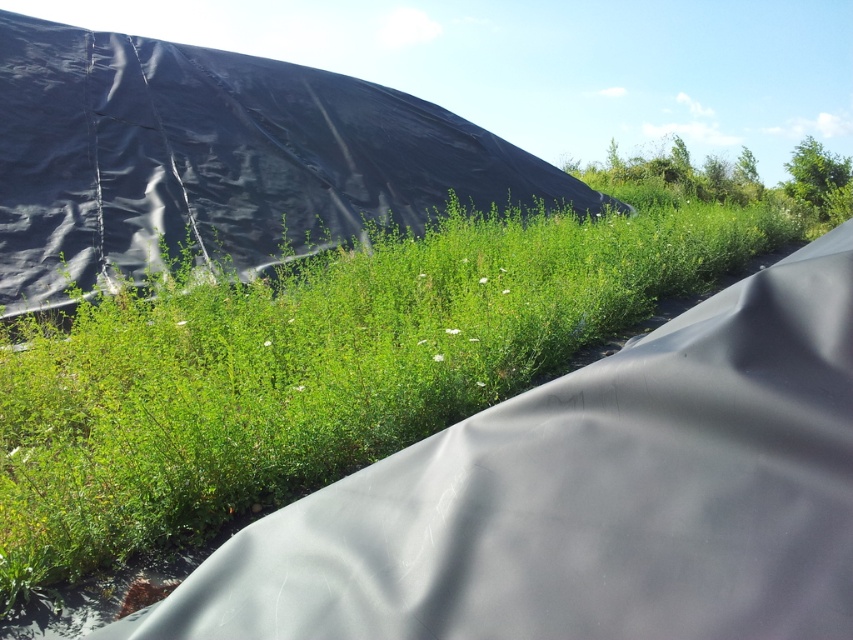
Is black tarp at upper left taller than metallic silver rock at lower left?

Indeed, black tarp at upper left has a greater height compared to metallic silver rock at lower left.

Is black tarp at upper left thinner than metallic silver rock at lower left?

No.

This screenshot has width=853, height=640. I want to click on black tarp at upper left, so [218, 160].

Locate an element on the screen. This screenshot has width=853, height=640. black tarp at upper left is located at coordinates (218, 160).

In the scene shown: Which is above, green matte grass at center or black tarp at upper left?

black tarp at upper left is above.

Is green matte grass at center thinner than black tarp at upper left?

Correct, green matte grass at center's width is less than black tarp at upper left's.

Is point (717, 262) behind point (67, 214)?

That is True.

Where is `green matte grass at center`? The height and width of the screenshot is (640, 853). green matte grass at center is located at coordinates (315, 365).

Is green matte grass at center positioned behind metallic silver rock at lower left?

Yes, it is behind metallic silver rock at lower left.

Which is in front, point (415, 419) or point (132, 600)?

Positioned in front is point (132, 600).

The image size is (853, 640). Identify the location of green matte grass at center. (315, 365).